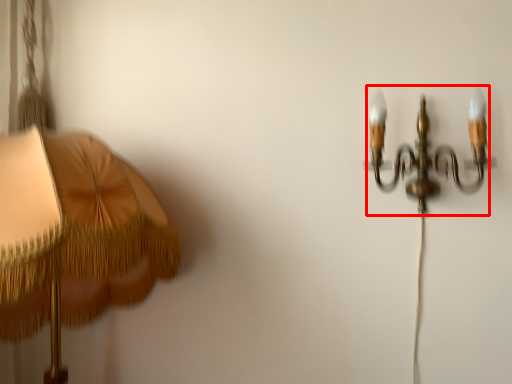
Question: From the image's perspective, where is lamp (annotated by the red box) located in relation to lamp in the image?

Choices:
 (A) above
 (B) below

Answer: (A)